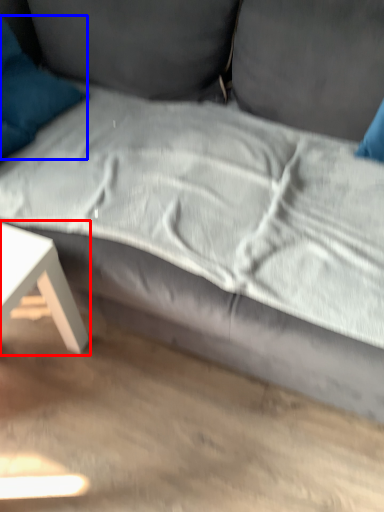
Question: Which object appears farthest to the camera in this image, table (highlighted by a red box) or pillow (highlighted by a blue box)?

Choices:
 (A) table
 (B) pillow

Answer: (B)